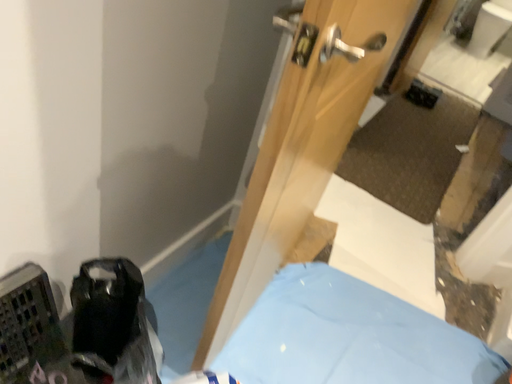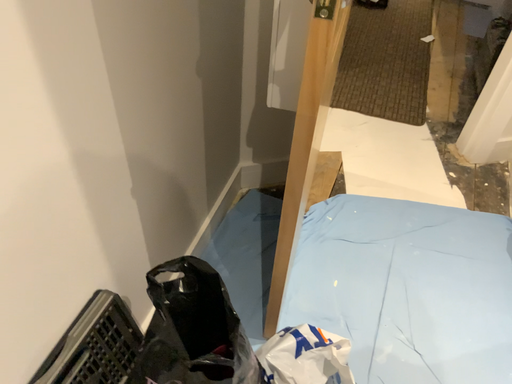
Question: How did the camera likely rotate when shooting the video?

Choices:
 (A) rotated downward
 (B) rotated upward

Answer: (A)